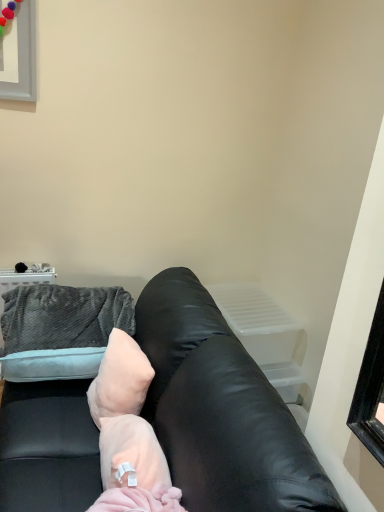
Question: From the image's perspective, is pink fluffy blanket at center located beneath black leather couch at center?

Choices:
 (A) yes
 (B) no

Answer: (B)

Question: From the image's perspective, does pink fluffy blanket at center appear higher than black leather couch at center?

Choices:
 (A) yes
 (B) no

Answer: (A)

Question: Does pink fluffy blanket at center have a lesser width compared to black leather couch at center?

Choices:
 (A) yes
 (B) no

Answer: (A)

Question: Is pink fluffy blanket at center bigger than black leather couch at center?

Choices:
 (A) no
 (B) yes

Answer: (A)

Question: Can you confirm if pink fluffy blanket at center is taller than black leather couch at center?

Choices:
 (A) no
 (B) yes

Answer: (A)

Question: Is velvety gray throw pillow at upper left inside the boundaries of pale pink plush pillow at center, or outside?

Choices:
 (A) outside
 (B) inside

Answer: (A)

Question: From the image's perspective, is velvety gray throw pillow at upper left above or below pale pink plush pillow at center?

Choices:
 (A) below
 (B) above

Answer: (B)

Question: From a real-world perspective, is velvety gray throw pillow at upper left physically located above or below pale pink plush pillow at center?

Choices:
 (A) above
 (B) below

Answer: (A)

Question: Considering their positions, is velvety gray throw pillow at upper left located in front of or behind pale pink plush pillow at center?

Choices:
 (A) behind
 (B) front

Answer: (A)

Question: Considering the positions of point (114, 371) and point (168, 501), is point (114, 371) closer or farther from the camera than point (168, 501)?

Choices:
 (A) farther
 (B) closer

Answer: (A)

Question: Considering the positions of pale pink plush pillow at center and pink fluffy blanket at center in the image, is pale pink plush pillow at center bigger or smaller than pink fluffy blanket at center?

Choices:
 (A) small
 (B) big

Answer: (A)

Question: From a real-world perspective, is pale pink plush pillow at center above or below pink fluffy blanket at center?

Choices:
 (A) below
 (B) above

Answer: (B)

Question: Is pale pink plush pillow at center spatially inside pink fluffy blanket at center, or outside of it?

Choices:
 (A) inside
 (B) outside

Answer: (B)

Question: Would you say pale pink plush pillow at center is to the left or to the right of black leather couch at center in the picture?

Choices:
 (A) right
 (B) left

Answer: (A)

Question: Considering the positions of point (110, 407) and point (251, 476), is point (110, 407) closer or farther from the camera than point (251, 476)?

Choices:
 (A) closer
 (B) farther

Answer: (B)